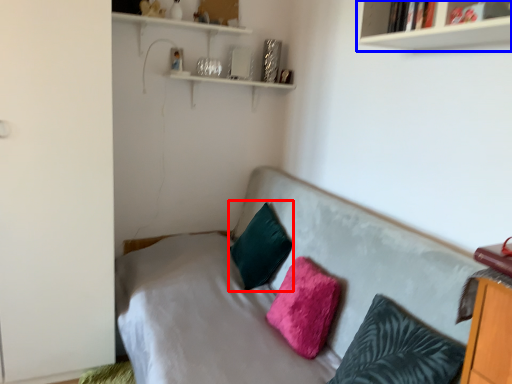
Question: Which of the following is the closest to the observer, pillow (highlighted by a red box) or shelf (highlighted by a blue box)?

Choices:
 (A) pillow
 (B) shelf

Answer: (B)